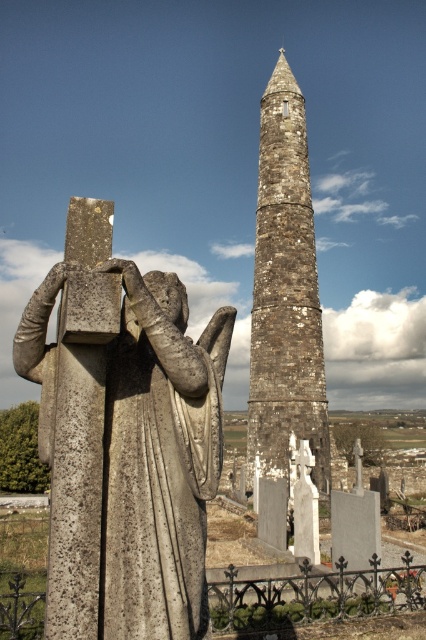
Question: Is gray stone statue at center above rustic stone tower at center?

Choices:
 (A) no
 (B) yes

Answer: (A)

Question: Where is gray stone statue at center located in relation to rustic stone tower at center in the image?

Choices:
 (A) above
 (B) below

Answer: (B)

Question: Considering the relative positions of gray stone statue at center and rustic stone tower at center in the image provided, where is gray stone statue at center located with respect to rustic stone tower at center?

Choices:
 (A) below
 (B) above

Answer: (A)

Question: Among these points, which one is nearest to the camera?

Choices:
 (A) (291, 278)
 (B) (140, 337)

Answer: (B)

Question: Which object is farther from the camera taking this photo?

Choices:
 (A) rustic stone tower at center
 (B) gray stone statue at center

Answer: (A)

Question: Which point is farther to the camera?

Choices:
 (A) gray stone statue at center
 (B) rustic stone tower at center

Answer: (B)